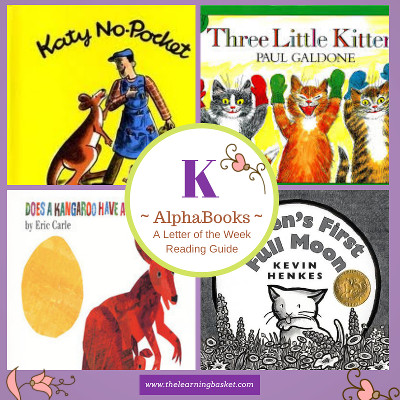
I want to click on book covers, so click(x=109, y=285), click(x=285, y=270), click(x=318, y=89), click(x=97, y=79).